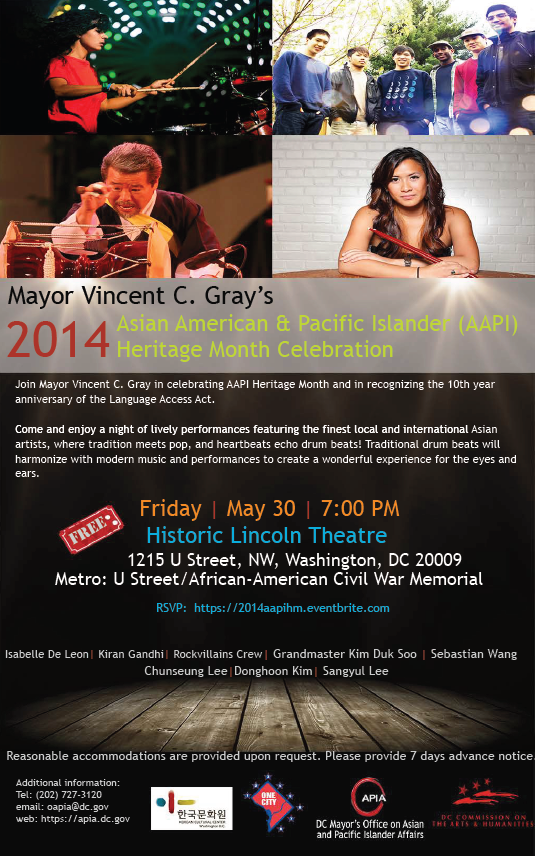
Identify the location of wooden panels. (266, 717).